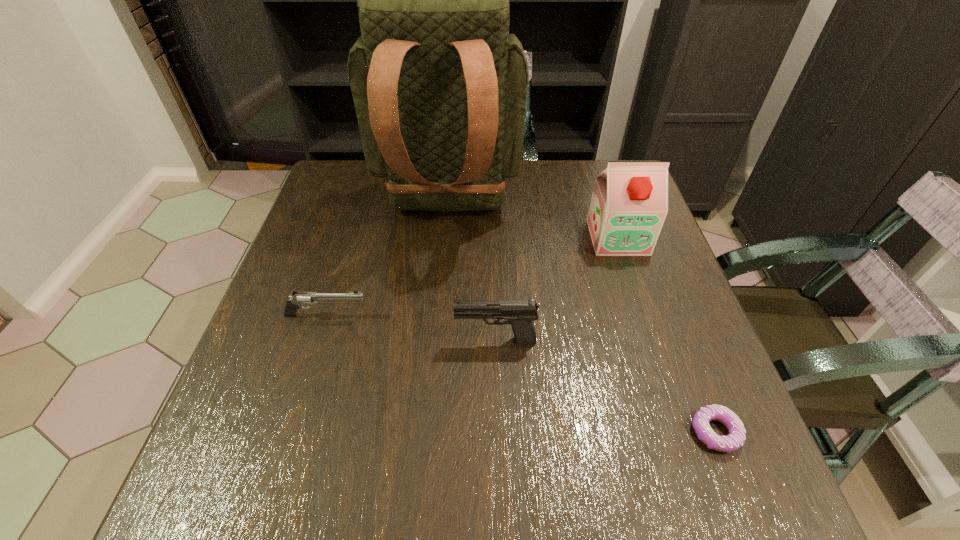
Where is `free space in the image that satisfies the following two spatial constraints: 1. with the cap open on the soya milk; 2. aim along the barrel of the right pistol`? Image resolution: width=960 pixels, height=540 pixels. free space in the image that satisfies the following two spatial constraints: 1. with the cap open on the soya milk; 2. aim along the barrel of the right pistol is located at coordinates (652, 340).

What are the coordinates of `free space that satisfies the following two spatial constraints: 1. with the cap open on the fourth shortest object; 2. aim along the barrel of the nearer pistol` in the screenshot? It's located at (652, 340).

I want to click on vacant area that satisfies the following two spatial constraints: 1. on the front-facing side of the shorter pistol; 2. on the right side of the doughnut, so pyautogui.click(x=291, y=432).

Locate an element on the screen. The width and height of the screenshot is (960, 540). free space that satisfies the following two spatial constraints: 1. with the cap open on the doughnut; 2. on the right side of the soya milk is located at coordinates (683, 432).

Locate an element on the screen. The height and width of the screenshot is (540, 960). vacant area in the image that satisfies the following two spatial constraints: 1. on the front-facing side of the nearest object; 2. on the left side of the fourth tallest object is located at coordinates (291, 432).